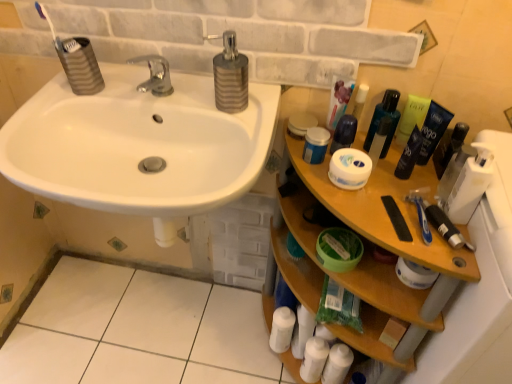
I want to click on vacant space in front of white matte jar at upper right, placed as the 6th mouthwash when sorted from right to left, so click(369, 203).